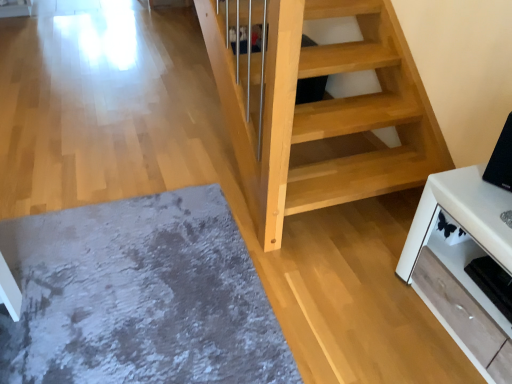
Question: Is black glossy tv at upper right with gray shaggy rug at lower left?

Choices:
 (A) no
 (B) yes

Answer: (A)

Question: Considering the relative sizes of black glossy tv at upper right and gray shaggy rug at lower left in the image provided, is black glossy tv at upper right smaller than gray shaggy rug at lower left?

Choices:
 (A) no
 (B) yes

Answer: (B)

Question: Can you confirm if black glossy tv at upper right is shorter than gray shaggy rug at lower left?

Choices:
 (A) yes
 (B) no

Answer: (B)

Question: From the image's perspective, is black glossy tv at upper right above gray shaggy rug at lower left?

Choices:
 (A) no
 (B) yes

Answer: (B)

Question: Is black glossy tv at upper right behind gray shaggy rug at lower left?

Choices:
 (A) no
 (B) yes

Answer: (B)

Question: Is gray shaggy rug at lower left a part of black glossy tv at upper right?

Choices:
 (A) yes
 (B) no

Answer: (B)

Question: Considering the relative positions of white glossy tv stand at lower right and gray shaggy rug at lower left in the image provided, is white glossy tv stand at lower right to the left of gray shaggy rug at lower left from the viewer's perspective?

Choices:
 (A) yes
 (B) no

Answer: (B)

Question: Considering the relative sizes of white glossy tv stand at lower right and gray shaggy rug at lower left in the image provided, is white glossy tv stand at lower right wider than gray shaggy rug at lower left?

Choices:
 (A) yes
 (B) no

Answer: (B)

Question: Is white glossy tv stand at lower right closer to the viewer compared to gray shaggy rug at lower left?

Choices:
 (A) no
 (B) yes

Answer: (B)

Question: Is white glossy tv stand at lower right next to gray shaggy rug at lower left?

Choices:
 (A) yes
 (B) no

Answer: (B)

Question: Does white glossy tv stand at lower right have a lesser width compared to gray shaggy rug at lower left?

Choices:
 (A) no
 (B) yes

Answer: (B)

Question: Is white glossy tv stand at lower right facing away from gray shaggy rug at lower left?

Choices:
 (A) no
 (B) yes

Answer: (A)

Question: Is gray shaggy rug at lower left turned away from white glossy tv stand at lower right?

Choices:
 (A) yes
 (B) no

Answer: (B)